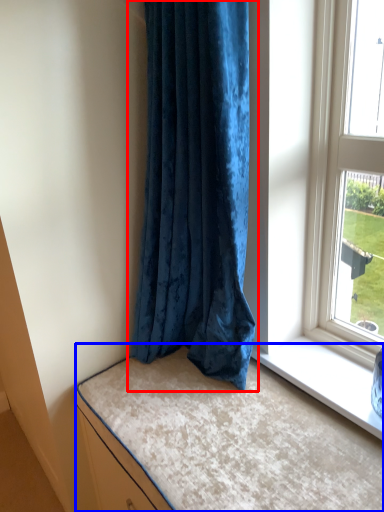
Question: Which of the following is the closest to the observer, curtain (highlighted by a red box) or bed (highlighted by a blue box)?

Choices:
 (A) curtain
 (B) bed

Answer: (B)